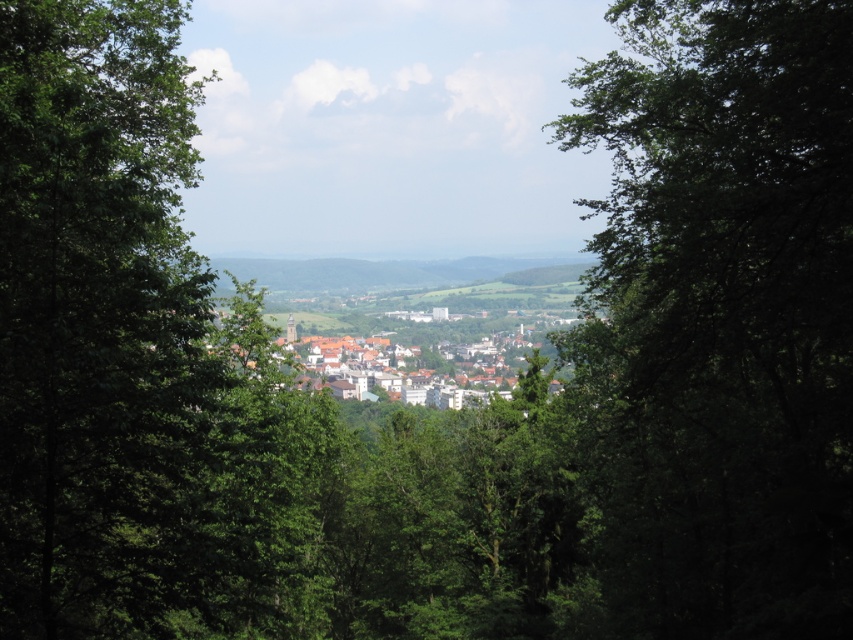
Between green leafy tree at center and green leafy tree at left, which one appears on the left side from the viewer's perspective?

From the viewer's perspective, green leafy tree at left appears more on the left side.

Between point (770, 195) and point (55, 456), which one is positioned behind?

Point (770, 195)

Where is `green leafy tree at center`? The width and height of the screenshot is (853, 640). green leafy tree at center is located at coordinates (718, 320).

Is point (738, 392) in front of point (473, 378)?

Yes.

Where is `green leafy tree at center`? The image size is (853, 640). green leafy tree at center is located at coordinates (718, 320).

Which of these two, green leafy tree at left or white matte buildings at center, stands shorter?

white matte buildings at center is shorter.

Can you confirm if green leafy tree at left is positioned to the right of white matte buildings at center?

No, green leafy tree at left is not to the right of white matte buildings at center.

Measure the distance between point (39, 500) and camera.

Point (39, 500) and camera are 345.05 meters apart.

You are a GUI agent. You are given a task and a screenshot of the screen. Output one action in this format:
    pyautogui.click(x=<x>, y=<y>)
    Task: Click on the green leafy tree at left
    The width and height of the screenshot is (853, 640).
    Given the screenshot: What is the action you would take?
    pyautogui.click(x=99, y=323)